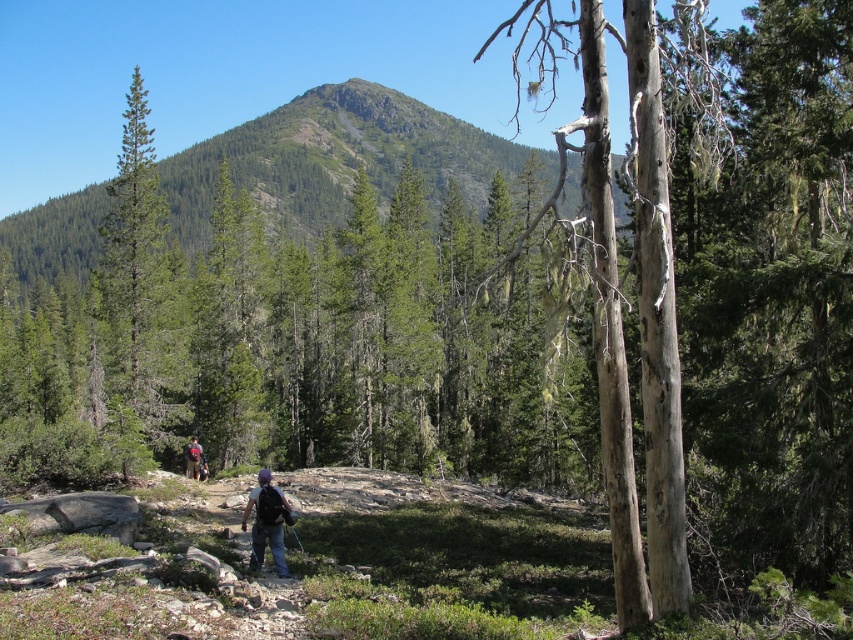
Is green matte tree at left further to the viewer compared to dark blue jeans at center?

Yes, it is behind dark blue jeans at center.

Between point (128, 248) and point (257, 554), which one is positioned behind?

The point (128, 248) is behind.

You are a GUI agent. You are given a task and a screenshot of the screen. Output one action in this format:
    pyautogui.click(x=<x>, y=<y>)
    Task: Click on the green matte tree at left
    Image resolution: width=853 pixels, height=640 pixels.
    Given the screenshot: What is the action you would take?
    pyautogui.click(x=140, y=280)

Which is above, dark blue jeans at center or matte gray backpack at center?

dark blue jeans at center is above.

Can you confirm if dark blue jeans at center is shorter than matte gray backpack at center?

Yes.

Between point (258, 497) and point (190, 451), which one is positioned behind?

Positioned behind is point (190, 451).

Find the location of `dark blue jeans at center`. dark blue jeans at center is located at coordinates (265, 522).

Is green matte tree at left closer to camera compared to matte gray backpack at center?

That is True.

Is green matte tree at left below matte gray backpack at center?

No, green matte tree at left is not below matte gray backpack at center.

Find the location of a particular element. The height and width of the screenshot is (640, 853). green matte tree at left is located at coordinates (140, 280).